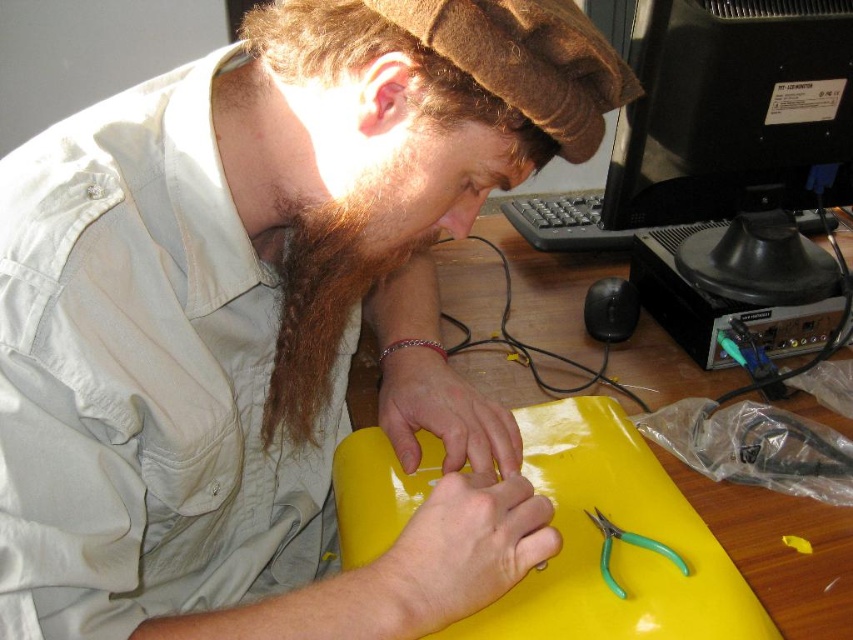
Question: Can you confirm if brown fuzzy beard at center is bigger than yellow plastic wire at center?

Choices:
 (A) yes
 (B) no

Answer: (B)

Question: Is brown fuzzy beard at center smaller than green plastic pliers at center?

Choices:
 (A) no
 (B) yes

Answer: (A)

Question: Can you confirm if yellow glossy table at center is smaller than green plastic pliers at center?

Choices:
 (A) no
 (B) yes

Answer: (A)

Question: Which object appears farthest from the camera in this image?

Choices:
 (A) yellow plastic wire at center
 (B) matte yellow plastic at center

Answer: (A)

Question: Which object appears farthest from the camera in this image?

Choices:
 (A) matte yellow plastic at center
 (B) yellow plastic wire at center
 (C) yellow glossy table at center
 (D) brown fuzzy beard at center

Answer: (B)

Question: Which object is farther from the camera taking this photo?

Choices:
 (A) matte yellow plastic at center
 (B) yellow plastic wire at center
 (C) yellow glossy table at center
 (D) green plastic pliers at center

Answer: (B)